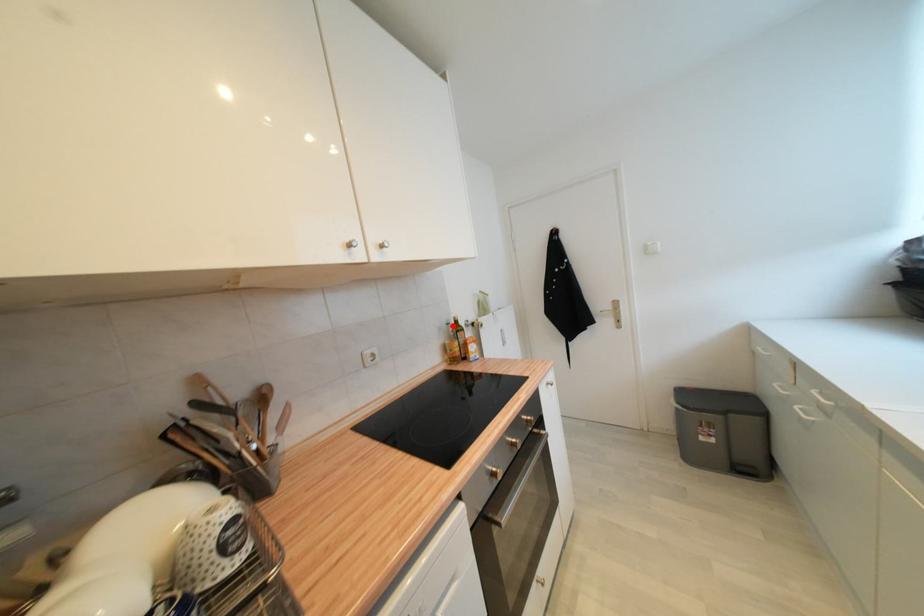
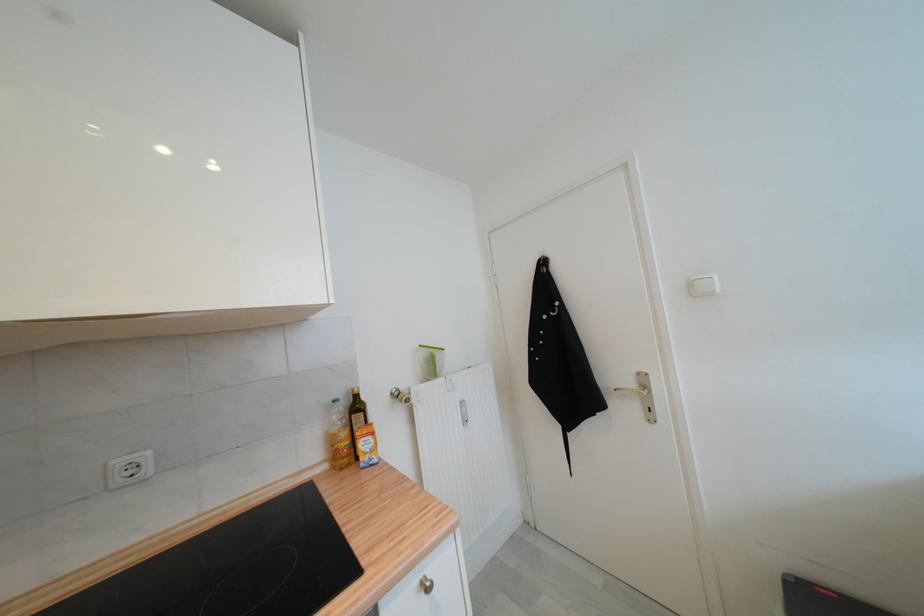
The point at the highlighted location is marked in the first image. Where is the corresponding point in the second image?

(339, 403)